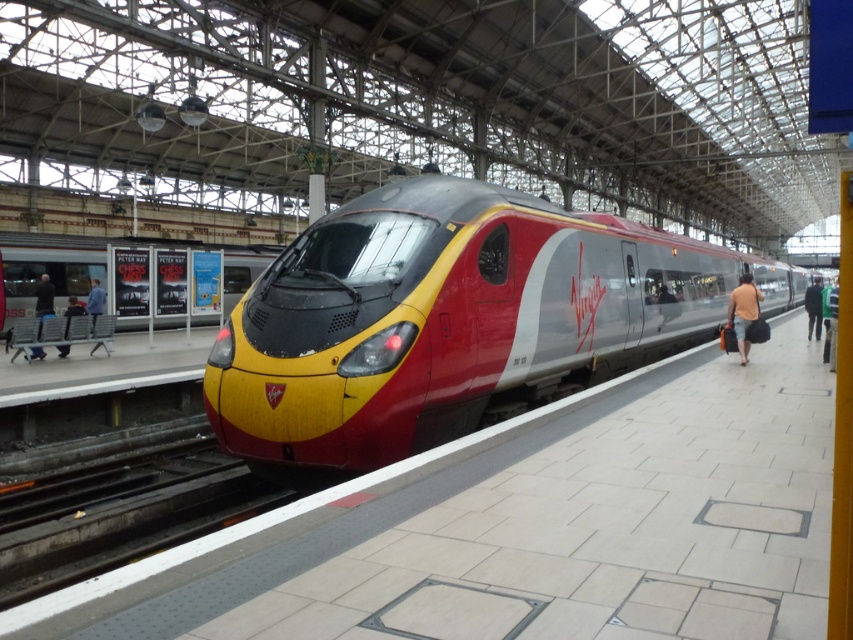
Question: Among these objects, which one is nearest to the camera?

Choices:
 (A) denim jacket at left
 (B) metallic silver train at center
 (C) green fabric jacket at right
 (D) dark blue jeans at lower left

Answer: (B)

Question: Based on their relative distances, which object is nearer to the green fabric jacket at right?

Choices:
 (A) dark blue jacket at center
 (B) metallic silver train at center

Answer: (A)

Question: Does metallic silver train at center come behind denim jacket at left?

Choices:
 (A) no
 (B) yes

Answer: (A)

Question: Does orange fabric bag at right appear under dark blue jeans at left?

Choices:
 (A) no
 (B) yes

Answer: (A)

Question: Does green fabric jacket at right appear on the left side of dark blue jeans at left?

Choices:
 (A) yes
 (B) no

Answer: (B)

Question: Which object is positioned farthest from the dark blue jeans at left?

Choices:
 (A) denim jacket at left
 (B) yellow glossy train at center
 (C) green fabric jacket at right

Answer: (C)